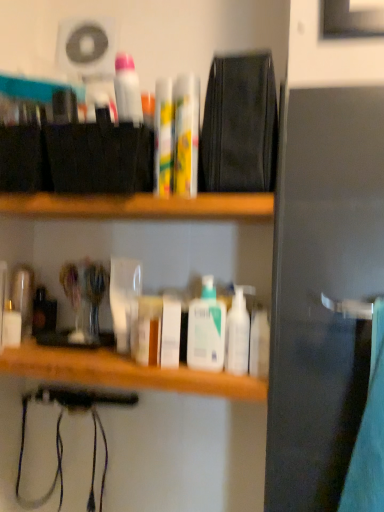
Question: Does yellow matte tube at center, the 4th toiletry positioned from the right, have a greater height compared to white glossy toothpaste at upper center?

Choices:
 (A) no
 (B) yes

Answer: (B)

Question: Can you confirm if yellow matte tube at center, placed as the seventh toiletry when sorted from left to right, is positioned to the left of white glossy toothpaste at upper center?

Choices:
 (A) yes
 (B) no

Answer: (B)

Question: From the image's perspective, is yellow matte tube at center, the 4th toiletry positioned from the right, under white glossy toothpaste at upper center?

Choices:
 (A) yes
 (B) no

Answer: (A)

Question: Does yellow matte tube at center, placed as the seventh toiletry when sorted from left to right, have a greater width compared to white glossy toothpaste at upper center?

Choices:
 (A) no
 (B) yes

Answer: (B)

Question: Is yellow matte tube at center, the 4th toiletry positioned from the right, oriented towards white glossy toothpaste at upper center?

Choices:
 (A) yes
 (B) no

Answer: (B)

Question: Is clear glass jar at left, placed as the 2th toiletry when sorted from left to right, in front of or behind white glossy lotion at center, the 3th toiletry positioned from the right, in the image?

Choices:
 (A) behind
 (B) front

Answer: (A)

Question: From a real-world perspective, is clear glass jar at left, which appears as the 9th toiletry when viewed from the right, above or below white glossy lotion at center, acting as the 8th toiletry starting from the left?

Choices:
 (A) below
 (B) above

Answer: (B)

Question: Considering the positions of clear glass jar at left, which appears as the 9th toiletry when viewed from the right, and white glossy lotion at center, acting as the 8th toiletry starting from the left, in the image, is clear glass jar at left, which appears as the 9th toiletry when viewed from the right, wider or thinner than white glossy lotion at center, acting as the 8th toiletry starting from the left,?

Choices:
 (A) thin
 (B) wide

Answer: (B)

Question: Considering the positions of clear glass jar at left, which appears as the 9th toiletry when viewed from the right, and white glossy lotion at center, acting as the 8th toiletry starting from the left, in the image, is clear glass jar at left, which appears as the 9th toiletry when viewed from the right, taller or shorter than white glossy lotion at center, acting as the 8th toiletry starting from the left,?

Choices:
 (A) tall
 (B) short

Answer: (A)

Question: In terms of size, does clear glass jar at left, which appears as the 9th toiletry when viewed from the right, appear bigger or smaller than white glossy lotion at center, marked as the 1th toiletry in a right-to-left arrangement?

Choices:
 (A) big
 (B) small

Answer: (A)

Question: From the image's perspective, is clear glass jar at left, which appears as the 9th toiletry when viewed from the right, positioned above or below white glossy lotion at center, marked as the 1th toiletry in a right-to-left arrangement?

Choices:
 (A) below
 (B) above

Answer: (B)

Question: Considering the positions of point (16, 287) and point (249, 369), is point (16, 287) closer or farther from the camera than point (249, 369)?

Choices:
 (A) closer
 (B) farther

Answer: (B)

Question: In terms of height, does clear glass jar at left, placed as the 2th toiletry when sorted from left to right, look taller or shorter compared to white glossy lotion at center, marked as the 1th toiletry in a right-to-left arrangement?

Choices:
 (A) short
 (B) tall

Answer: (B)

Question: Is white glossy lotion at center, the 6th toiletry in the left-to-right sequence, inside the boundaries of yellow-green plastic tubes at center, the 5th toiletry positioned from the left, or outside?

Choices:
 (A) outside
 (B) inside

Answer: (A)

Question: In terms of height, does white glossy lotion at center, the 6th toiletry in the left-to-right sequence, look taller or shorter compared to yellow-green plastic tubes at center, arranged as the 6th toiletry when viewed from the right?

Choices:
 (A) short
 (B) tall

Answer: (A)